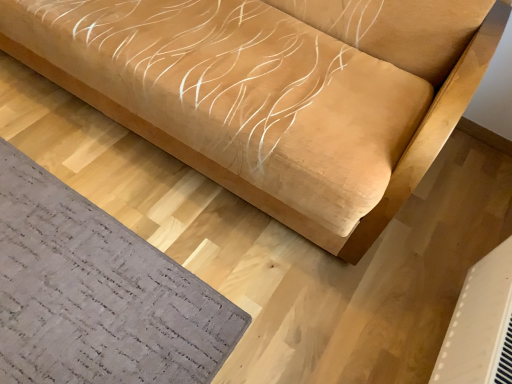
This screenshot has width=512, height=384. Find the location of `empty space that is ontop of gray textured mat at lower left (from a real-world perspective)`. empty space that is ontop of gray textured mat at lower left (from a real-world perspective) is located at coordinates (81, 279).